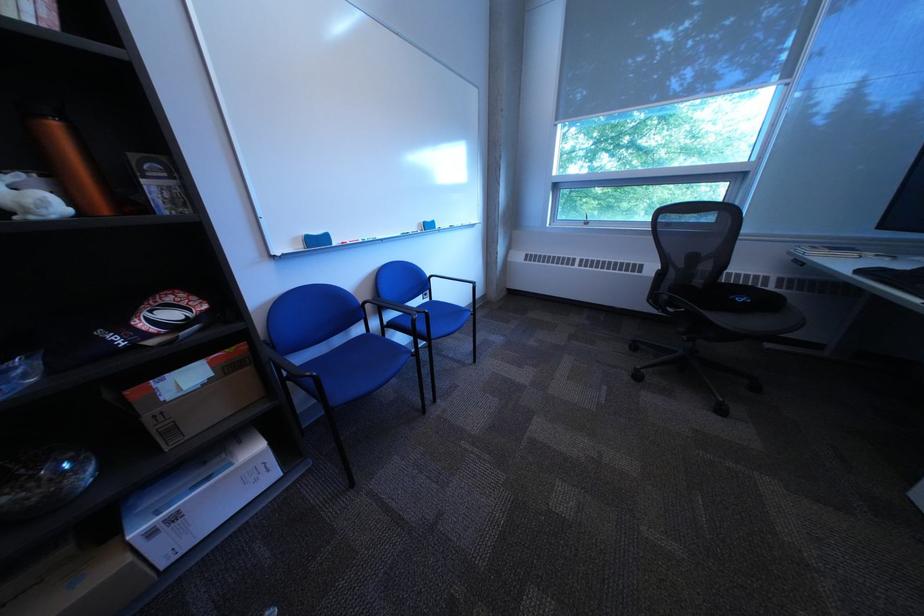
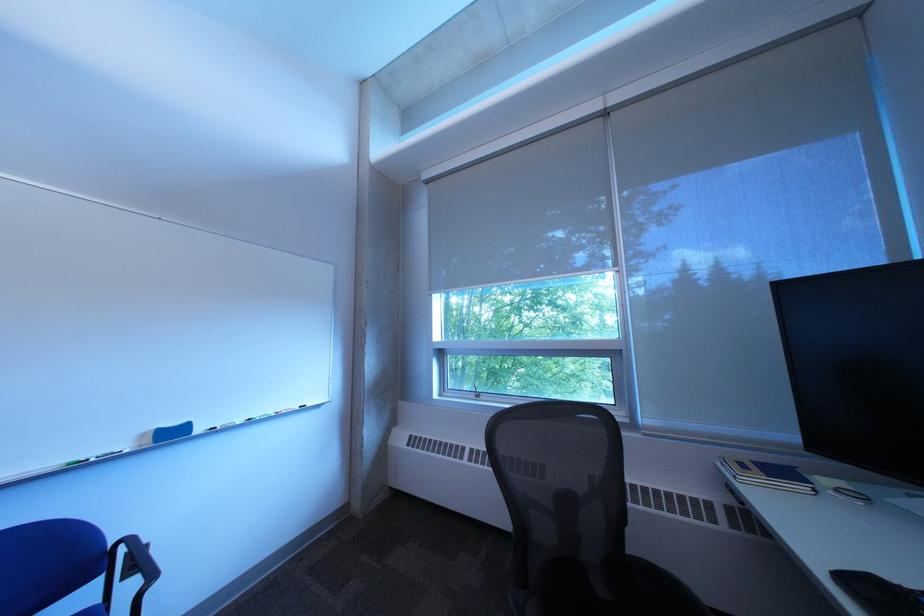
Find the pixel in the second image that matches point (714, 92) in the first image.

(611, 267)